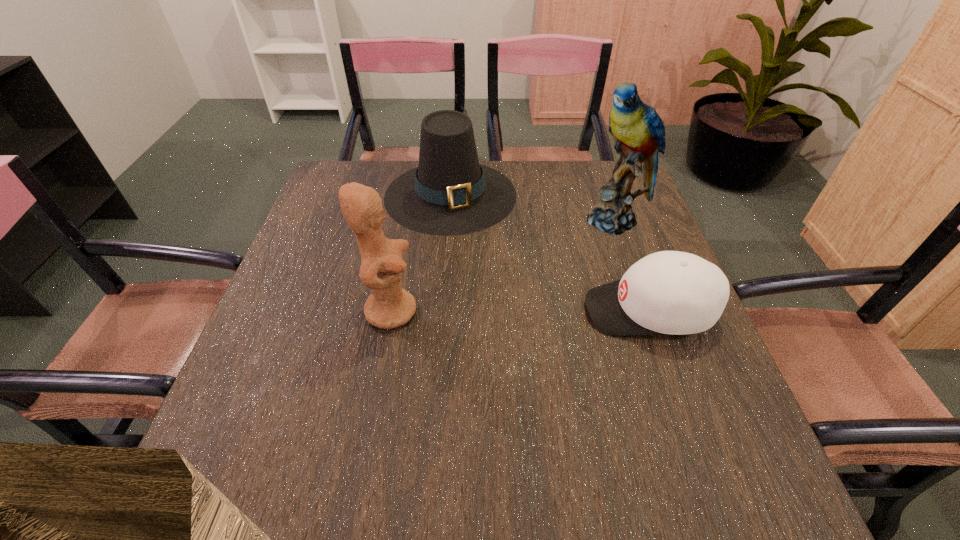
Identify the location of vacant space at the near edge of the desktop. The width and height of the screenshot is (960, 540). click(x=384, y=404).

Locate an element on the screen. The height and width of the screenshot is (540, 960). free location at the left edge of the desktop is located at coordinates (321, 377).

The image size is (960, 540). Identify the location of free point at the right edge. (698, 393).

Locate an element on the screen. The image size is (960, 540). free space at the far left corner of the desktop is located at coordinates (330, 173).

At what (x,y) coordinates should I click in order to perform the action: click on vacant area at the near right corner of the desktop. Please return your answer as a coordinate pair (x, y). Looking at the image, I should click on (689, 429).

Identify the location of vacant area that lies between the baseball cap and the hat. Image resolution: width=960 pixels, height=540 pixels. (550, 253).

Locate an element on the screen. blank region between the third shortest object and the hat is located at coordinates (420, 253).

I want to click on free spot between the figurine and the parrot, so click(504, 265).

At what (x,y) coordinates should I click in order to perform the action: click on empty location between the shortest object and the figurine. Please return your answer as a coordinate pair (x, y). The height and width of the screenshot is (540, 960). Looking at the image, I should click on (520, 310).

Where is `free space between the second tallest object and the baseball cap`? The width and height of the screenshot is (960, 540). free space between the second tallest object and the baseball cap is located at coordinates (520, 310).